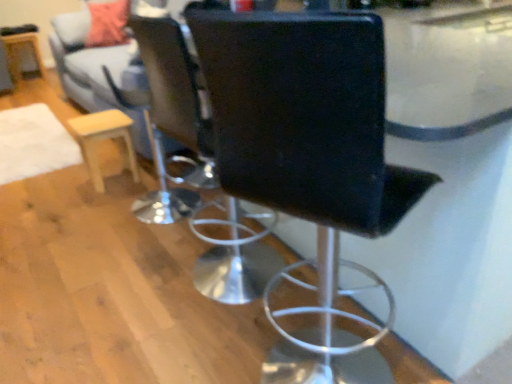
At what (x,y) coordinates should I click in order to perform the action: click on free space to the left of light wood/finely finished stool at left. Please return your answer as a coordinate pair (x, y). Looking at the image, I should click on (64, 184).